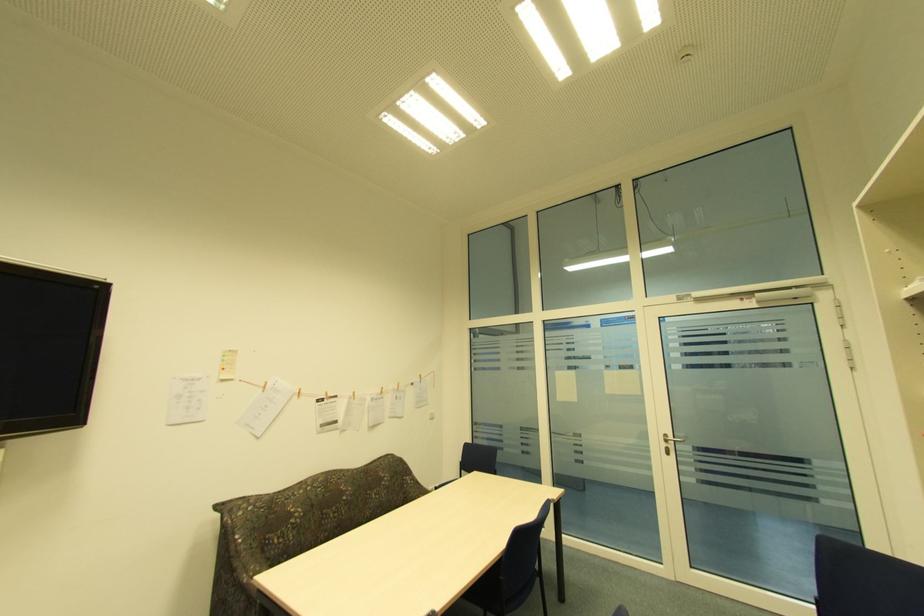
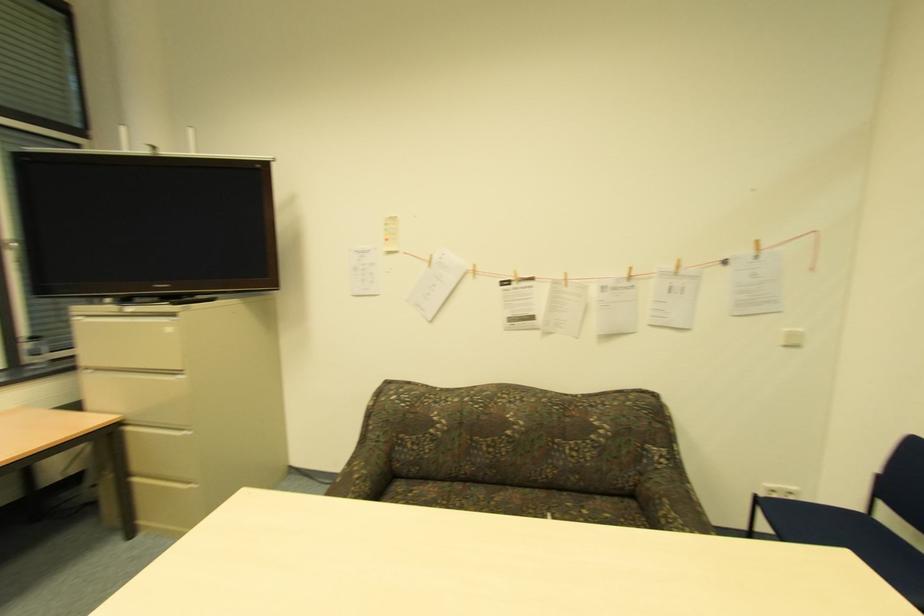
Where in the second image is the point corresponding to (x=433, y=414) from the first image?

(792, 334)